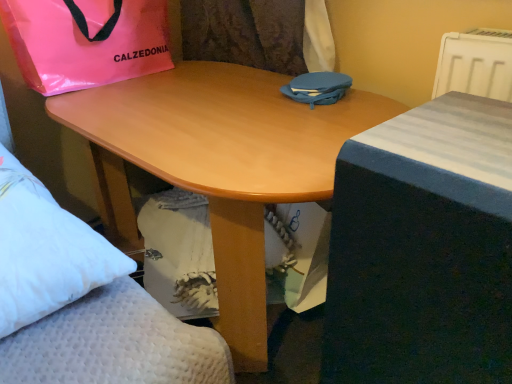
Question: From a real-world perspective, is white plastic radiator at upper right below blue fabric bed at right?

Choices:
 (A) yes
 (B) no

Answer: (B)

Question: Is white plastic radiator at upper right at the left side of blue fabric bed at right?

Choices:
 (A) yes
 (B) no

Answer: (B)

Question: Is white plastic radiator at upper right outside blue fabric bed at right?

Choices:
 (A) no
 (B) yes

Answer: (B)

Question: Is white plastic radiator at upper right positioned in front of blue fabric bed at right?

Choices:
 (A) yes
 (B) no

Answer: (B)

Question: Can you confirm if white plastic radiator at upper right is shorter than blue fabric bed at right?

Choices:
 (A) no
 (B) yes

Answer: (B)

Question: Considering the positions of light wood desk at center and pink plastic bag at upper left, placed as the second bag when sorted from right to left, in the image, is light wood desk at center taller or shorter than pink plastic bag at upper left, placed as the second bag when sorted from right to left,?

Choices:
 (A) tall
 (B) short

Answer: (A)

Question: Considering the positions of light wood desk at center and pink plastic bag at upper left, which is the 1th bag in left-to-right order, in the image, is light wood desk at center bigger or smaller than pink plastic bag at upper left, which is the 1th bag in left-to-right order,?

Choices:
 (A) small
 (B) big

Answer: (B)

Question: Would you say light wood desk at center is to the left or to the right of pink plastic bag at upper left, which is the 1th bag in left-to-right order, in the picture?

Choices:
 (A) left
 (B) right

Answer: (B)

Question: Relative to pink plastic bag at upper left, placed as the second bag when sorted from right to left, is light wood desk at center in front or behind?

Choices:
 (A) behind
 (B) front

Answer: (B)

Question: From a real-world perspective, is white plastic radiator at upper right above or below blue fabric bed at right?

Choices:
 (A) above
 (B) below

Answer: (A)

Question: Considering their positions, is white plastic radiator at upper right located in front of or behind blue fabric bed at right?

Choices:
 (A) front
 (B) behind

Answer: (B)

Question: In terms of size, does white plastic radiator at upper right appear bigger or smaller than blue fabric bed at right?

Choices:
 (A) small
 (B) big

Answer: (A)

Question: In terms of height, does white plastic radiator at upper right look taller or shorter compared to blue fabric bed at right?

Choices:
 (A) short
 (B) tall

Answer: (A)

Question: Considering their positions, is blue fabric bag at center, acting as the 2th bag starting from the left, located in front of or behind pink plastic bag at upper left, which is the 1th bag in left-to-right order?

Choices:
 (A) behind
 (B) front

Answer: (B)

Question: Is blue fabric bag at center, acting as the 2th bag starting from the left, inside or outside of pink plastic bag at upper left, which is the 1th bag in left-to-right order?

Choices:
 (A) outside
 (B) inside

Answer: (A)